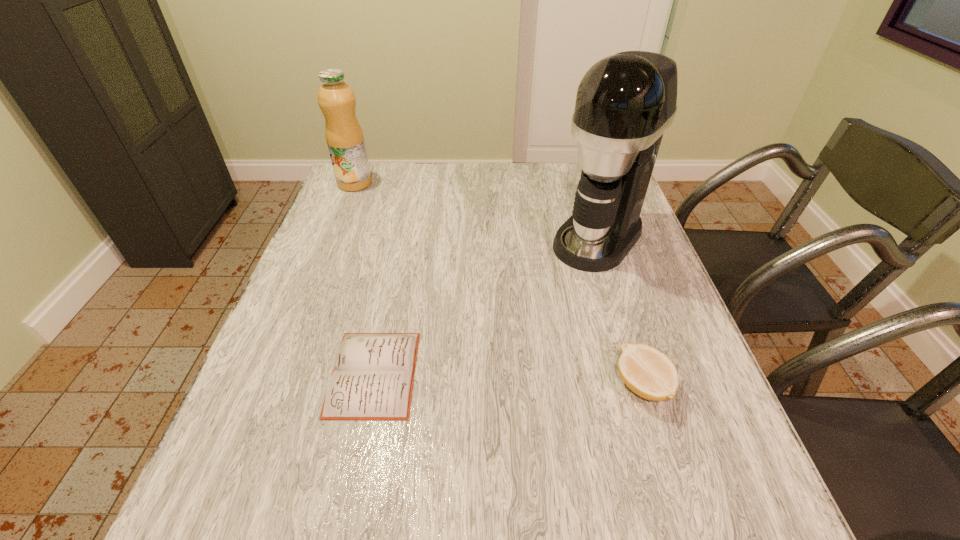
Where is `the closest object to the second farthest object`? The width and height of the screenshot is (960, 540). the closest object to the second farthest object is located at coordinates (649, 373).

Locate an element on the screen. This screenshot has width=960, height=540. vacant point that satisfies the following two spatial constraints: 1. on the front side of the diary; 2. on the left side of the lemon is located at coordinates (372, 386).

Image resolution: width=960 pixels, height=540 pixels. Identify the location of blank area in the image that satisfies the following two spatial constraints: 1. on the front side of the third tallest object; 2. on the right side of the shortest object. (372, 386).

Image resolution: width=960 pixels, height=540 pixels. I want to click on vacant region that satisfies the following two spatial constraints: 1. on the front side of the second shortest object; 2. on the left side of the diary, so click(x=372, y=386).

Find the location of a particular element. Image resolution: width=960 pixels, height=540 pixels. free space that satisfies the following two spatial constraints: 1. on the front side of the lemon; 2. on the left side of the fruit juice is located at coordinates point(275,386).